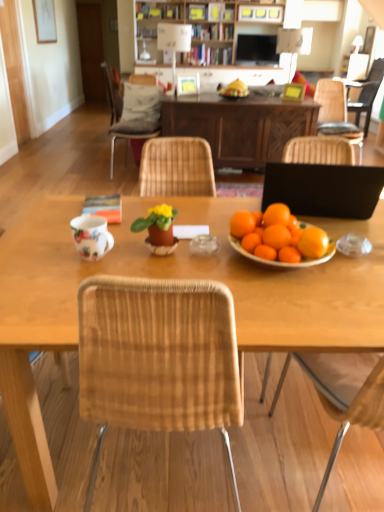
Find the location of a particular element. vacant space positioned to the left of floral ceramic mug at center is located at coordinates (42, 253).